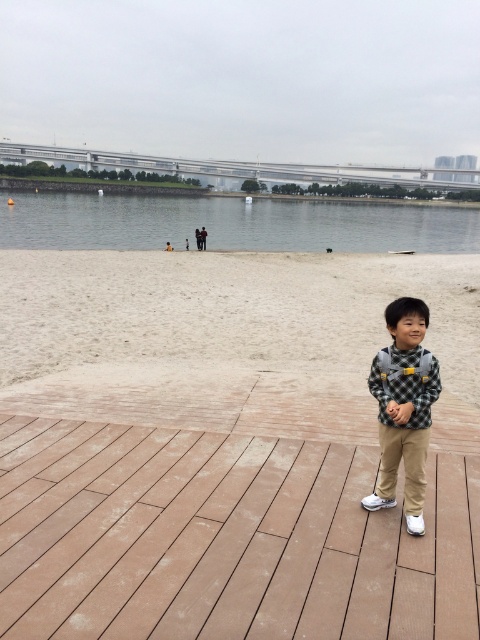
Question: Which object appears farthest from the camera in this image?

Choices:
 (A) brown wood deck at center
 (B) checkered fabric shirt at center
 (C) clear water at lower center

Answer: (C)

Question: Which is farther from the checkered fabric shirt at center?

Choices:
 (A) white sand at lower center
 (B) clear water at lower center

Answer: (B)

Question: In this image, where is white sand at lower center located relative to checkered fabric shirt at center?

Choices:
 (A) above
 (B) below

Answer: (A)

Question: Is brown wood deck at center above white sand at lower center?

Choices:
 (A) no
 (B) yes

Answer: (A)

Question: Does brown wood deck at center appear on the left side of white sand at lower center?

Choices:
 (A) yes
 (B) no

Answer: (A)

Question: Estimate the real-world distances between objects in this image. Which object is closer to the brown wood deck at center?

Choices:
 (A) clear water at lower center
 (B) white sand at lower center
 (C) checkered fabric shirt at center

Answer: (C)